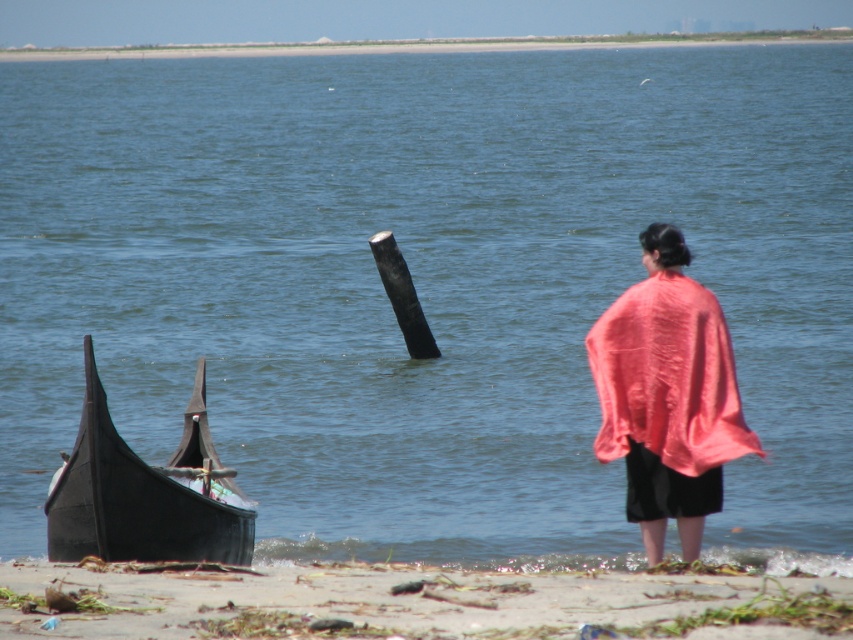
You are a lifeguard standing on the sandy beach at lower left and need to reach the black polished wood boat at lower left to retrieve a floating device. Can you walk directly to the boat without needing to swim?

The distance between the sandy beach at lower left and the black polished wood boat at lower left is 2.43 meters. Since the boat is partially submerged in shallow water, you can walk to it as the distance is manageable on foot without needing to swim.

You are a photographer planning to capture a wide shot of the coastal scene. You want to include both the sandy beach at lower left and the pink fabric at right in your frame. Based on their sizes, which object should you focus on to ensure both are visible without cropping?

The sandy beach at lower left is larger in size compared to the pink fabric at right. To include both in the frame without cropping, focus on the sandy beach at lower left as it occupies more space, allowing the smaller pink fabric at right to fit naturally within the composition.

You are standing at the center of the image and want to walk to the sandy beach at lower left. Which direction should you move in to reach it?

The sandy beach at lower left is located at point (412, 604) in 2D coordinates, so you should move towards the lower left direction to reach it.